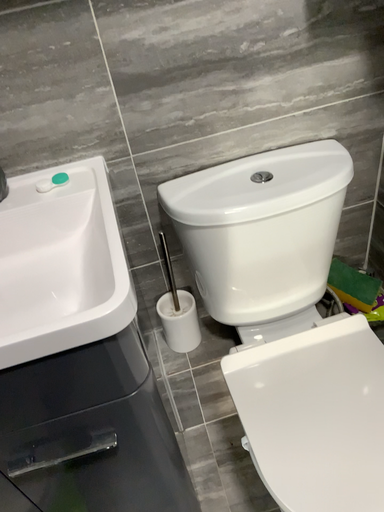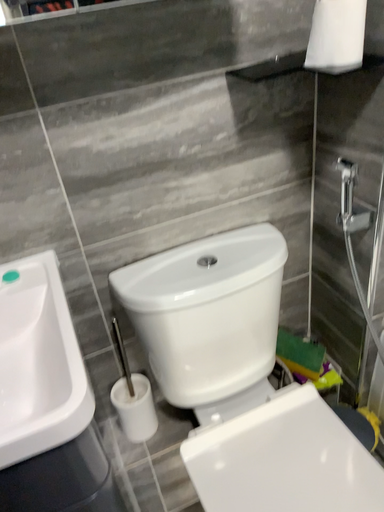
Question: How did the camera likely rotate when shooting the video?

Choices:
 (A) rotated downward
 (B) rotated upward

Answer: (B)